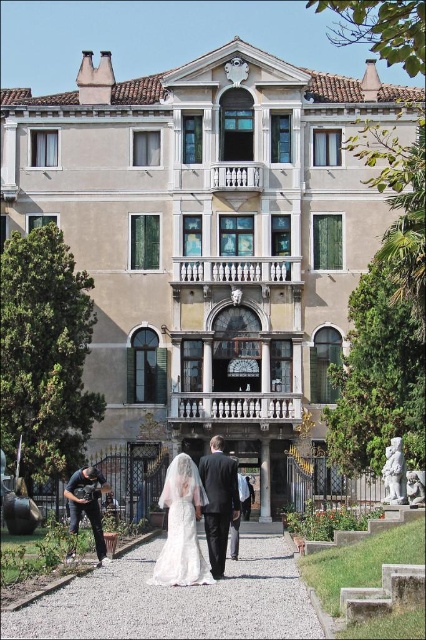
Looking at this image, between gray gravel path at center and dark gray suit at center, which one appears on the right side from the viewer's perspective?

From the viewer's perspective, dark gray suit at center appears more on the right side.

Is point (267, 593) less distant than point (218, 557)?

Yes.

Is point (164, 611) in front of point (222, 474)?

Yes, point (164, 611) is in front of point (222, 474).

This screenshot has width=426, height=640. Identify the location of gray gravel path at center. (178, 600).

Is white lace dress at center positioned before dark gray suit at center?

Yes, it is in front of dark gray suit at center.

The image size is (426, 640). What do you see at coordinates (181, 528) in the screenshot?
I see `white lace dress at center` at bounding box center [181, 528].

At what (x,y) coordinates should I click in order to perform the action: click on white lace dress at center. Please return your answer as a coordinate pair (x, y). Looking at the image, I should click on (181, 528).

Is gray gravel path at center positioned at the back of white lace dress at center?

No, gray gravel path at center is in front of white lace dress at center.

Does gray gravel path at center have a lesser height compared to white lace dress at center?

Yes, gray gravel path at center is shorter than white lace dress at center.

Describe the element at coordinates (178, 600) in the screenshot. I see `gray gravel path at center` at that location.

This screenshot has height=640, width=426. I want to click on gray gravel path at center, so click(x=178, y=600).